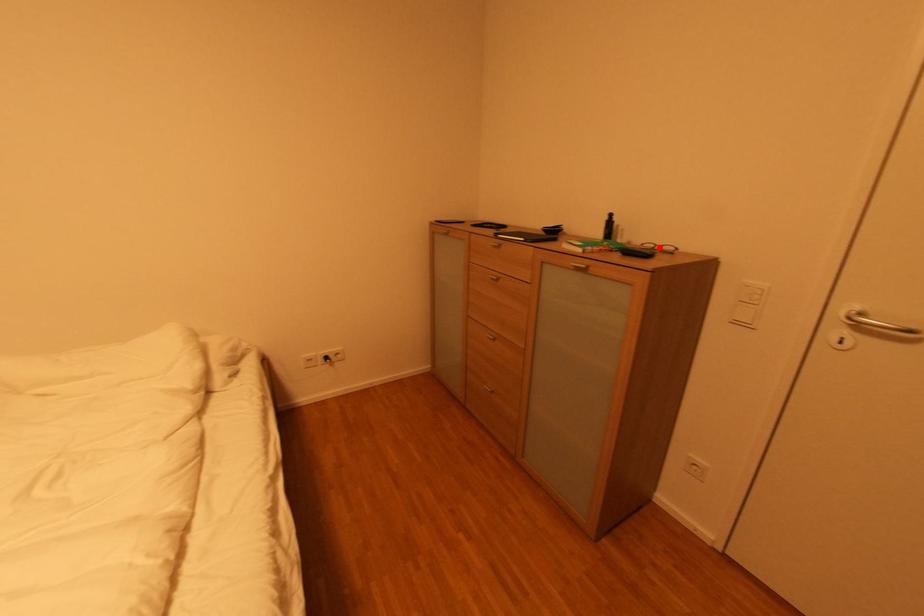
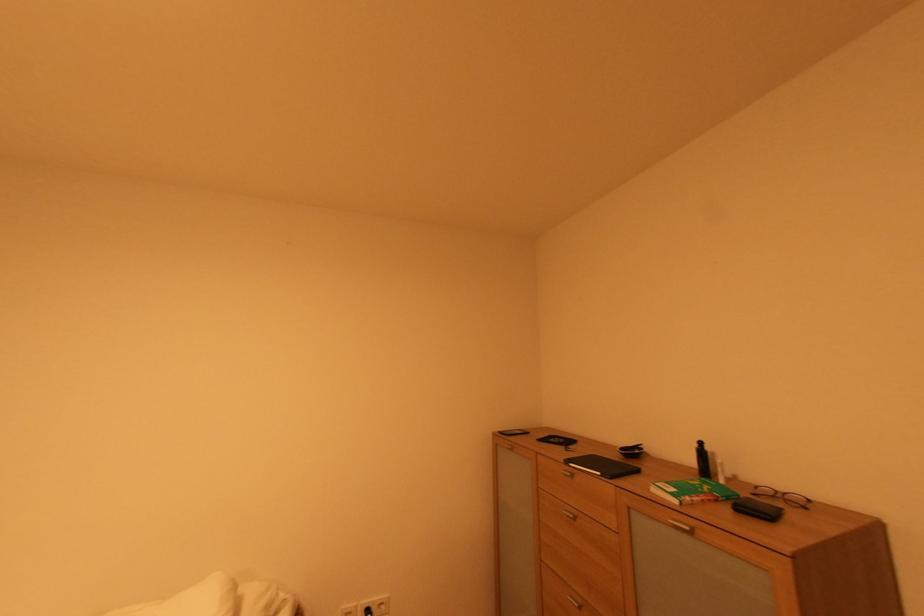
The point at the highlighted location is marked in the first image. Where is the corresponding point in the second image?

(777, 493)